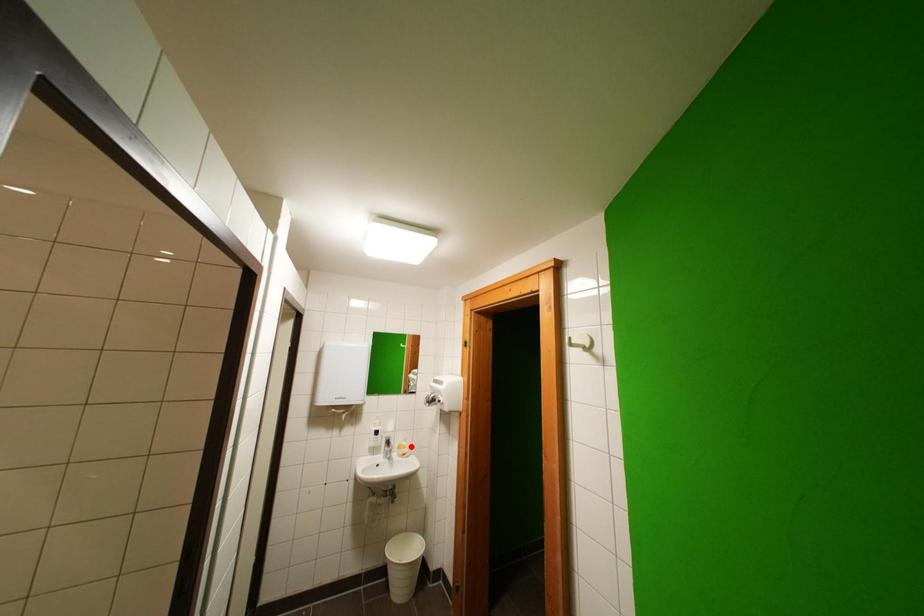
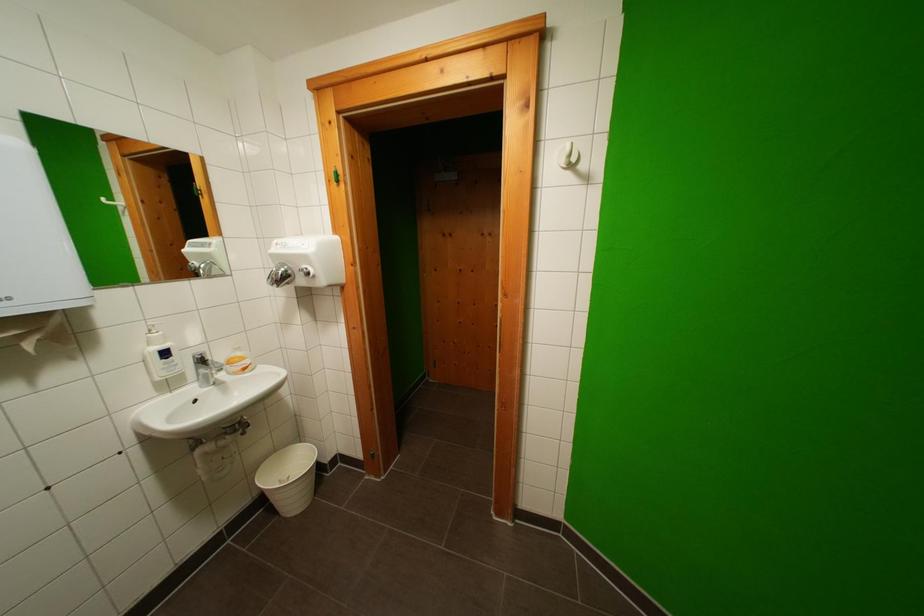
Where in the second image is the point corresponding to the highlighted location from the first image?

(246, 357)